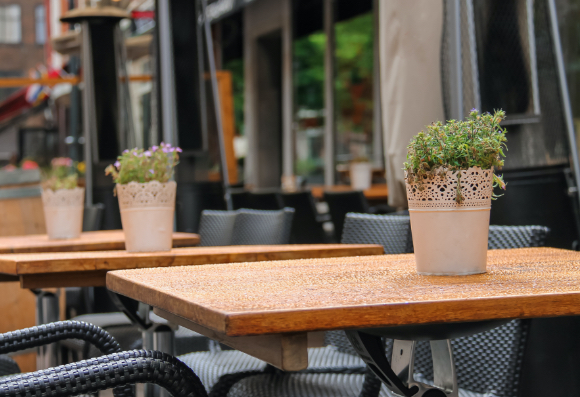
At what (x,y) coordinates should I click in order to perform the action: click on plant in white can. Please return your answer as a coordinate pair (x, y). Looking at the image, I should click on pos(437,231), pos(477,180), pos(152,225), pos(158,195), pos(72,225), pos(77,193).